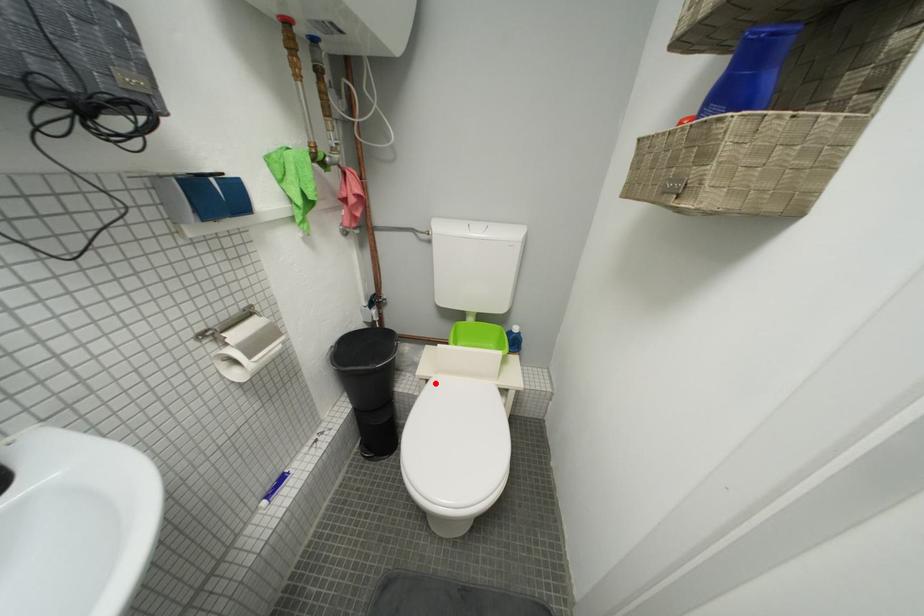
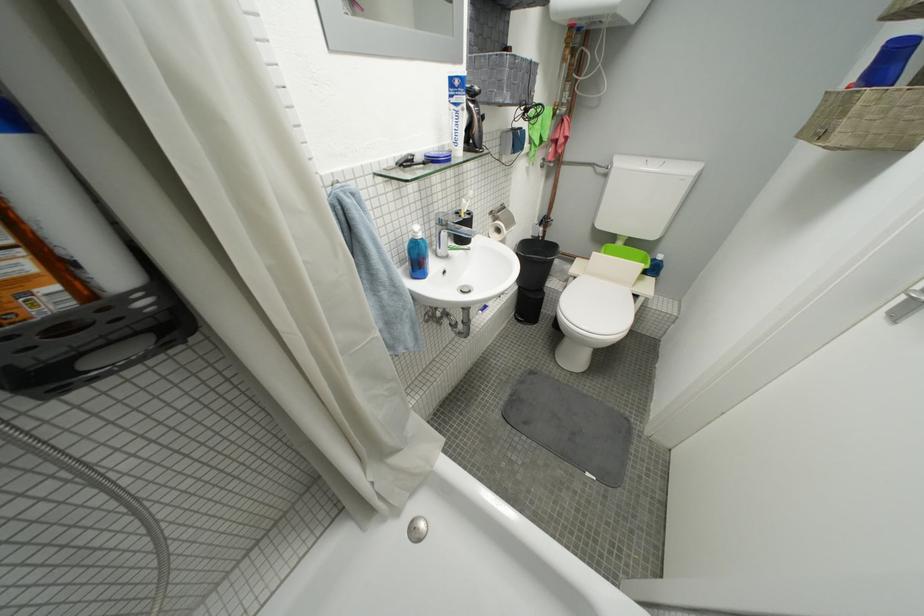
The point at the highlighted location is marked in the first image. Where is the corresponding point in the second image?

(584, 281)